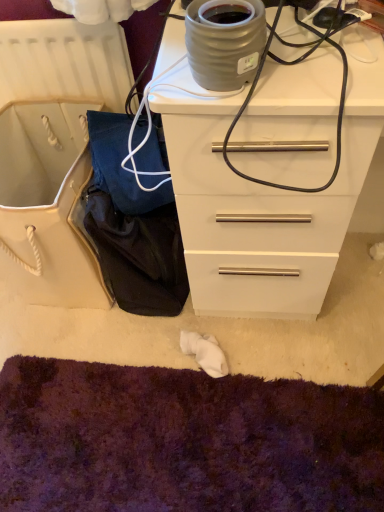
You are a GUI agent. You are given a task and a screenshot of the screen. Output one action in this format:
    pyautogui.click(x=<x>, y=<y>)
    Task: Click on the matte gray ceramic pot at upper center
    
    Given the screenshot: What is the action you would take?
    pyautogui.click(x=224, y=41)

What is the approximate height of purple shaggy carpet at lower center?

The height of purple shaggy carpet at lower center is 2.30 inches.

The width and height of the screenshot is (384, 512). What do you see at coordinates (184, 441) in the screenshot?
I see `purple shaggy carpet at lower center` at bounding box center [184, 441].

Where is `white glossy chest of drawers at upper right`? white glossy chest of drawers at upper right is located at coordinates click(x=264, y=204).

From the image's perspective, is purple shaggy carpet at lower center positioned above or below white glossy chest of drawers at upper right?

Clearly, from the image's perspective, purple shaggy carpet at lower center is below white glossy chest of drawers at upper right.

Is purple shaggy carpet at lower center closer to camera compared to white glossy chest of drawers at upper right?

No, purple shaggy carpet at lower center is further to the viewer.

Considering the relative sizes of purple shaggy carpet at lower center and white glossy chest of drawers at upper right in the image provided, is purple shaggy carpet at lower center bigger than white glossy chest of drawers at upper right?

No, purple shaggy carpet at lower center is not bigger than white glossy chest of drawers at upper right.

Where is `cat bed that is under the white glossy chest of drawers at upper right (from a real-world perspective)`? This screenshot has height=512, width=384. cat bed that is under the white glossy chest of drawers at upper right (from a real-world perspective) is located at coordinates (184, 441).

Is point (53, 465) closer to camera compared to point (256, 59)?

No, it is behind (256, 59).

In the image, is purple shaggy carpet at lower center positioned in front of or behind matte gray ceramic pot at upper center?

Visually, purple shaggy carpet at lower center is located behind matte gray ceramic pot at upper center.

Considering the positions of objects purple shaggy carpet at lower center and matte gray ceramic pot at upper center in the image provided, who is more to the left, purple shaggy carpet at lower center or matte gray ceramic pot at upper center?

purple shaggy carpet at lower center is more to the left.

Choose the correct answer: Is purple shaggy carpet at lower center inside matte gray ceramic pot at upper center or outside it?

The correct answer is: outside.

Between matte gray ceramic pot at upper center and white glossy chest of drawers at upper right, which one has smaller width?

With smaller width is matte gray ceramic pot at upper center.

Does matte gray ceramic pot at upper center lie behind white glossy chest of drawers at upper right?

That is True.

Find the location of a particular element. The height and width of the screenshot is (512, 384). chest of drawers that is on the right side of matte gray ceramic pot at upper center is located at coordinates (264, 204).

From the image's perspective, which is above, matte gray ceramic pot at upper center or white glossy chest of drawers at upper right?

matte gray ceramic pot at upper center, from the image's perspective.

Looking at this image, from a real-world perspective, does matte gray ceramic pot at upper center stand above purple shaggy carpet at lower center?

Yes.

Is matte gray ceramic pot at upper center positioned behind purple shaggy carpet at lower center?

No, the depth of matte gray ceramic pot at upper center is less than that of purple shaggy carpet at lower center.

From the image's perspective, is matte gray ceramic pot at upper center beneath purple shaggy carpet at lower center?

No.

Which object is wider, matte gray ceramic pot at upper center or purple shaggy carpet at lower center?

purple shaggy carpet at lower center.

Is white glossy chest of drawers at upper right inside or outside of matte gray ceramic pot at upper center?

white glossy chest of drawers at upper right is outside matte gray ceramic pot at upper center.

Consider the image. Are white glossy chest of drawers at upper right and matte gray ceramic pot at upper center far apart?

No, white glossy chest of drawers at upper right is not far away from matte gray ceramic pot at upper center.

What's the angular difference between white glossy chest of drawers at upper right and matte gray ceramic pot at upper center's facing directions?

The facing directions of white glossy chest of drawers at upper right and matte gray ceramic pot at upper center are 1.29 degrees apart.

Does white glossy chest of drawers at upper right turn towards matte gray ceramic pot at upper center?

No, white glossy chest of drawers at upper right is not turned towards matte gray ceramic pot at upper center.

Which of these two, white glossy chest of drawers at upper right or purple shaggy carpet at lower center, stands taller?

With more height is white glossy chest of drawers at upper right.

Measure the distance between white glossy chest of drawers at upper right and purple shaggy carpet at lower center.

white glossy chest of drawers at upper right is 19.13 inches from purple shaggy carpet at lower center.

Is white glossy chest of drawers at upper right at the left side of purple shaggy carpet at lower center?

In fact, white glossy chest of drawers at upper right is to the right of purple shaggy carpet at lower center.

From the image's perspective, is white glossy chest of drawers at upper right below purple shaggy carpet at lower center?

Incorrect, from the image's perspective, white glossy chest of drawers at upper right is higher than purple shaggy carpet at lower center.

Where is `cat bed behind the white glossy chest of drawers at upper right`? This screenshot has width=384, height=512. cat bed behind the white glossy chest of drawers at upper right is located at coordinates (184, 441).

Identify the location of appliance above the purple shaggy carpet at lower center (from the image's perspective). (224, 41).

Looking at the image, which one is located closer to white glossy chest of drawers at upper right, purple shaggy carpet at lower center or matte gray ceramic pot at upper center?

matte gray ceramic pot at upper center is closer to white glossy chest of drawers at upper right.

When comparing their distances from purple shaggy carpet at lower center, does white glossy chest of drawers at upper right or matte gray ceramic pot at upper center seem closer?

Based on the image, white glossy chest of drawers at upper right appears to be nearer to purple shaggy carpet at lower center.

Based on their spatial positions, is purple shaggy carpet at lower center or white glossy chest of drawers at upper right closer to matte gray ceramic pot at upper center?

Based on the image, white glossy chest of drawers at upper right appears to be nearer to matte gray ceramic pot at upper center.

From the image, which object appears to be nearer to white glossy chest of drawers at upper right, matte gray ceramic pot at upper center or purple shaggy carpet at lower center?

Among the two, matte gray ceramic pot at upper center is located nearer to white glossy chest of drawers at upper right.

Considering their positions, is white glossy chest of drawers at upper right positioned closer to matte gray ceramic pot at upper center than purple shaggy carpet at lower center?

The object closer to matte gray ceramic pot at upper center is white glossy chest of drawers at upper right.

From the image, which object appears to be farther from purple shaggy carpet at lower center, matte gray ceramic pot at upper center or white glossy chest of drawers at upper right?

Among the two, matte gray ceramic pot at upper center is located further to purple shaggy carpet at lower center.

Identify the location of chest of drawers between matte gray ceramic pot at upper center and purple shaggy carpet at lower center in the vertical direction. point(264,204).